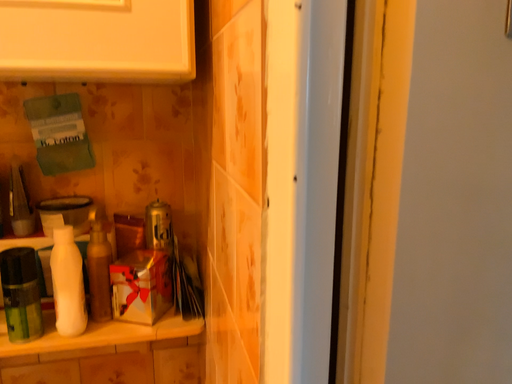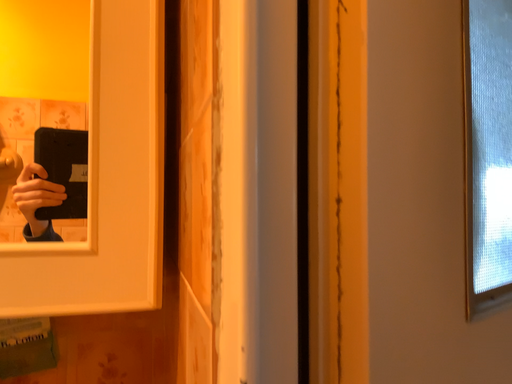
Question: Which way did the camera rotate in the video?

Choices:
 (A) rotated downward
 (B) rotated upward

Answer: (B)